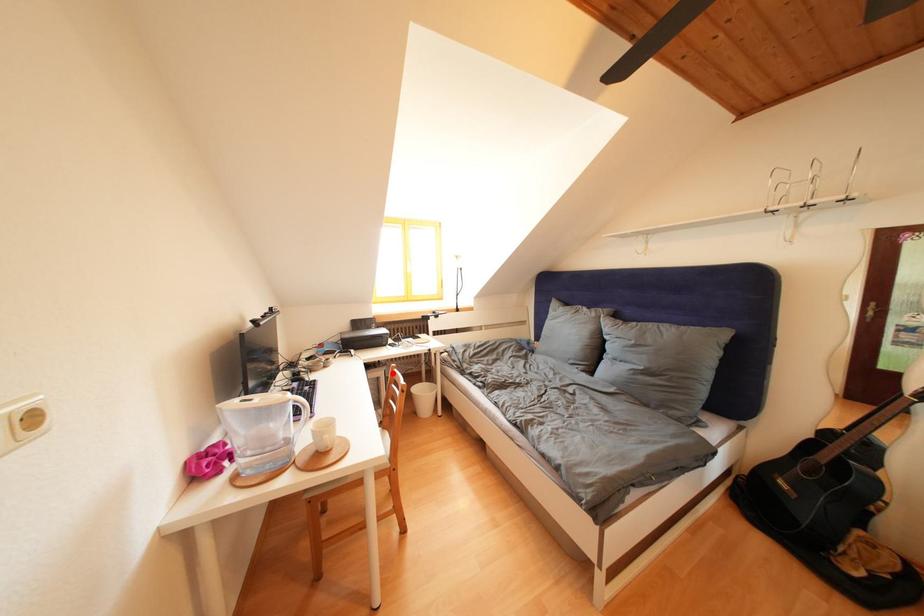
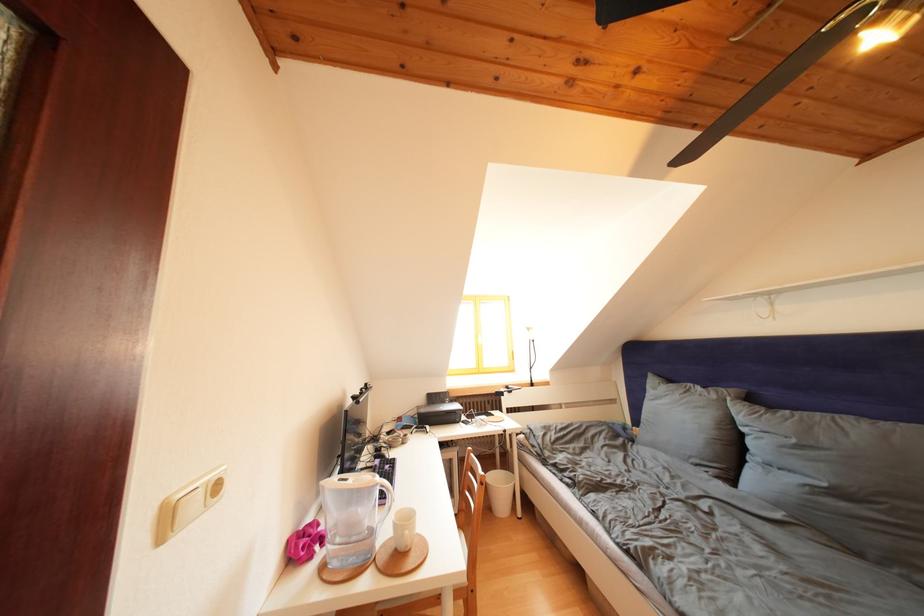
In the second image, find the point that corresponds to the highlighted location in the first image.

(466, 454)